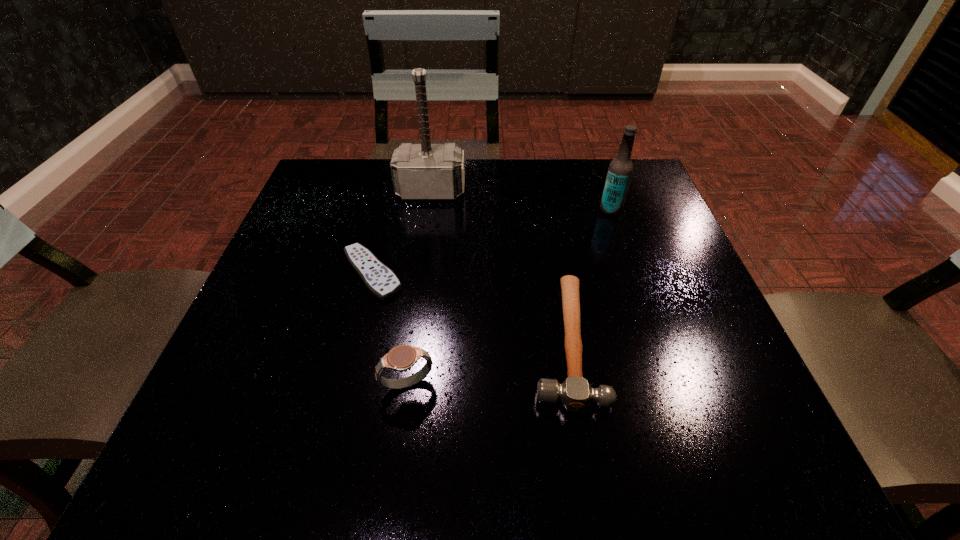
Identify the location of free region at the far edge of the desktop. This screenshot has width=960, height=540. (388, 159).

Find the location of a particular element. blank space at the near edge is located at coordinates (559, 446).

In the image, there is a desktop. Identify the location of blank space at the left edge. (333, 226).

In the image, there is a desktop. Where is `vacant space at the right edge`? The width and height of the screenshot is (960, 540). vacant space at the right edge is located at coordinates (661, 216).

Identify the location of vacant space at the far right corner of the desktop. The image size is (960, 540). (633, 163).

At what (x,y) coordinates should I click in order to perform the action: click on free space at the near right corner of the desktop. Please return your answer as a coordinate pair (x, y). The image size is (960, 540). Looking at the image, I should click on (740, 430).

Where is `free point between the shortest object and the watch`? free point between the shortest object and the watch is located at coordinates (390, 329).

Locate an element on the screen. Image resolution: width=960 pixels, height=540 pixels. empty location between the remote control and the watch is located at coordinates (390, 329).

In order to click on free space between the rightmost object and the farther hammer in this screenshot , I will do `click(520, 201)`.

Locate an element on the screen. The width and height of the screenshot is (960, 540). vacant area between the third tallest object and the remote control is located at coordinates (390, 329).